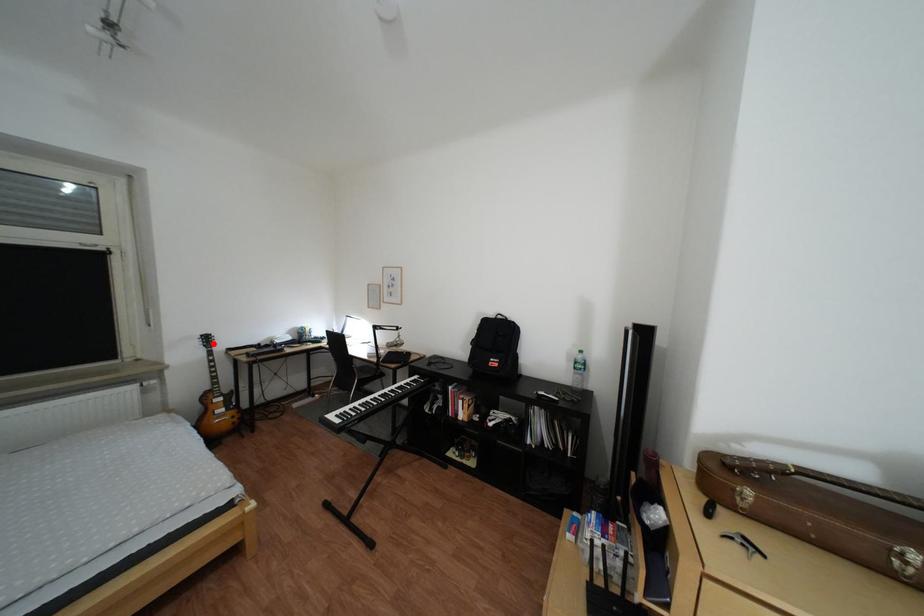
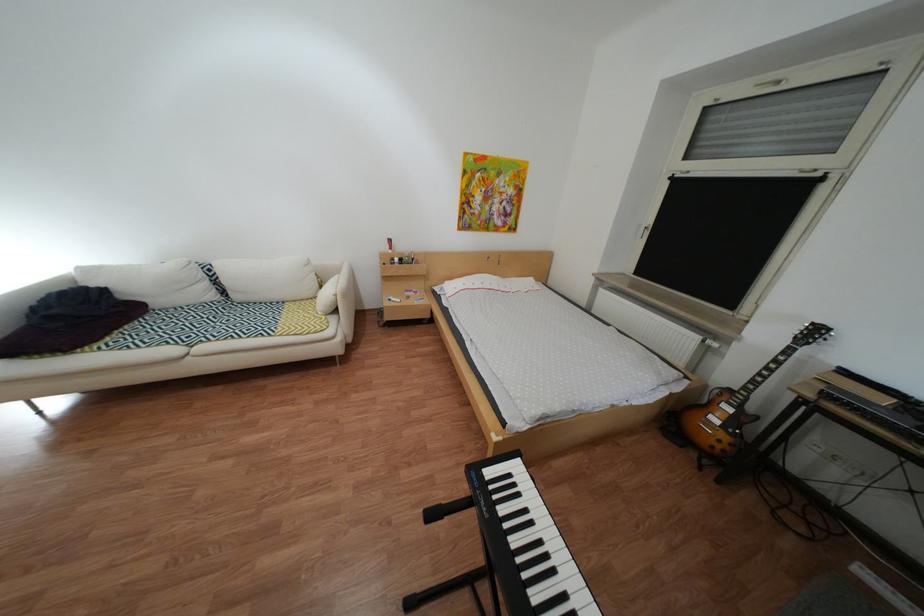
Question: I am providing you with two images of the same scene from different viewpoints. In image1, a red point is highlighted. Considering the same 3D point in image2, which of the following is correct?

Choices:
 (A) It is closer
 (B) It is farther

Answer: (B)